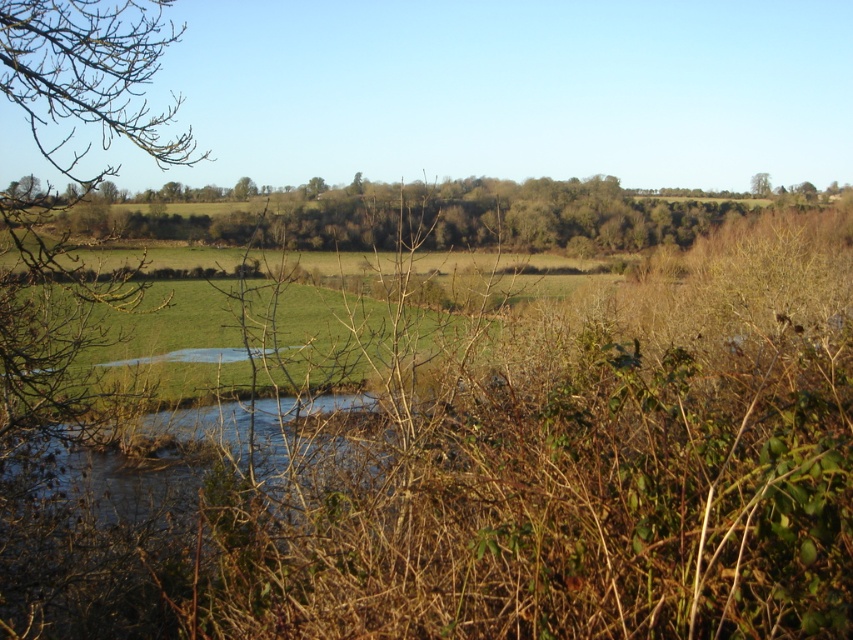
Can you confirm if brown textured tree at center is positioned above brown leafy tree at upper right?

Actually, brown textured tree at center is below brown leafy tree at upper right.

Is brown textured tree at center taller than brown leafy tree at upper right?

Yes, brown textured tree at center is taller than brown leafy tree at upper right.

Which is in front, point (239, 180) or point (763, 186)?

Point (239, 180) is more forward.

Locate an element on the screen. brown textured tree at center is located at coordinates (244, 188).

Is brown textured tree at center smaller than green leafy tree at center?

Indeed, brown textured tree at center has a smaller size compared to green leafy tree at center.

Between brown textured tree at center and green leafy tree at center, which one appears on the left side from the viewer's perspective?

From the viewer's perspective, brown textured tree at center appears more on the left side.

Find the location of a particular element. This screenshot has height=640, width=853. brown textured tree at center is located at coordinates (244, 188).

At what (x,y) coordinates should I click in order to perform the action: click on brown textured tree at center. Please return your answer as a coordinate pair (x, y). Looking at the image, I should click on (244, 188).

Is point (111, 88) positioned after point (305, 188)?

No, (111, 88) is in front of (305, 188).

Does bare branches at upper left appear over green leafy tree at center?

Yes.

At what (x,y) coordinates should I click in order to perform the action: click on bare branches at upper left. Please return your answer as a coordinate pair (x, y). Looking at the image, I should click on (90, 77).

The width and height of the screenshot is (853, 640). Find the location of `bare branches at upper left`. bare branches at upper left is located at coordinates (90, 77).